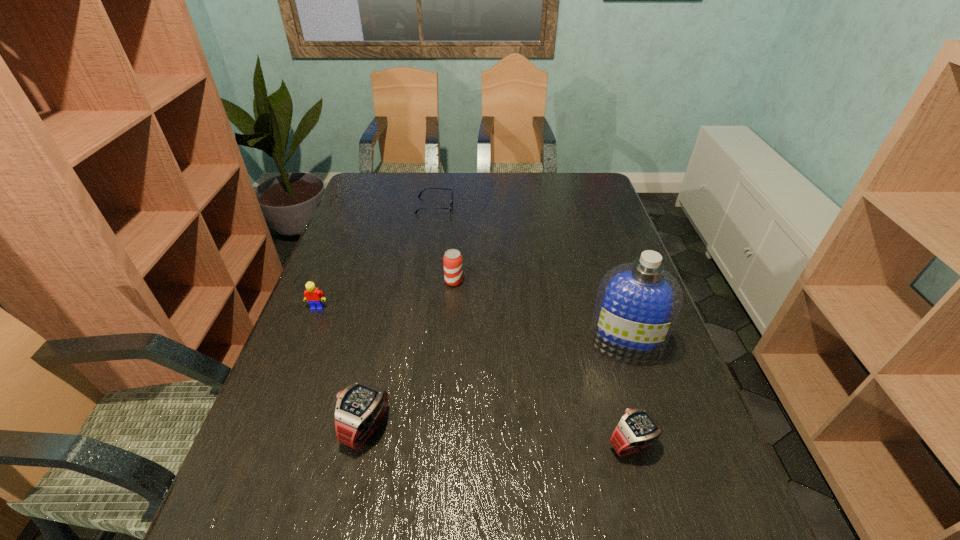
Identify the location of vacant spot for a new watch to ensure equal spacing. (496, 436).